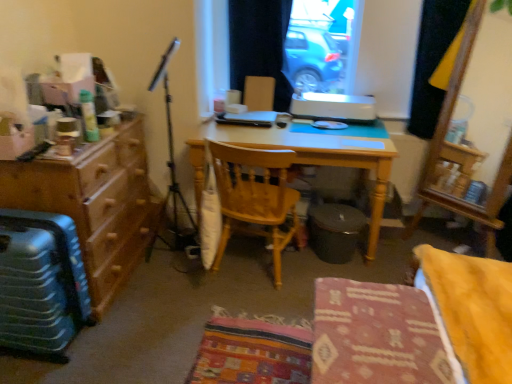
What are the coordinates of `vacant area that lies to the right of metallic suitcase at lower left` in the screenshot? It's located at (129, 337).